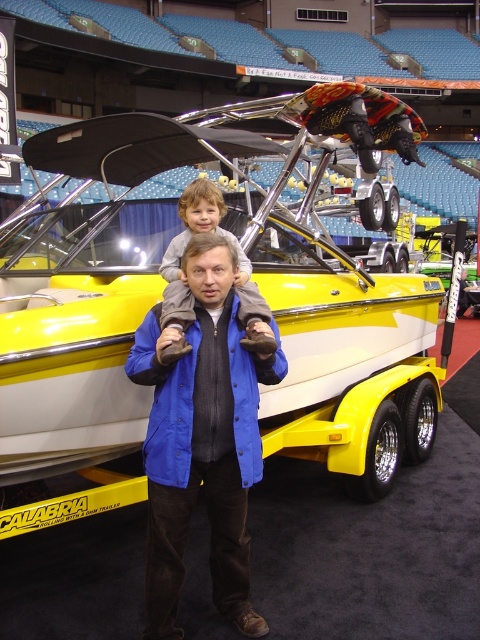
You are a photographer at the boat show and want to capture both the blue fabric jacket at center and the light brown plush pants at center in a single photo. The camera you are using has a maximum focus range of 25 inches. Will you be able to capture both subjects in focus?

The distance between the blue fabric jacket at center and the light brown plush pants at center is 24.88 inches, which is within the camera maximum focus range of 25 inches. Therefore, both subjects can be captured in focus.

You are a photographer at the boat show and want to capture both the blue fabric jacket at center and the light brown plush pants at center in the same frame. Which object should you focus on first to ensure both are in the shot?

You should focus on the blue fabric jacket at center first since it is in front of the light brown plush pants at center, ensuring both will be captured in the frame.